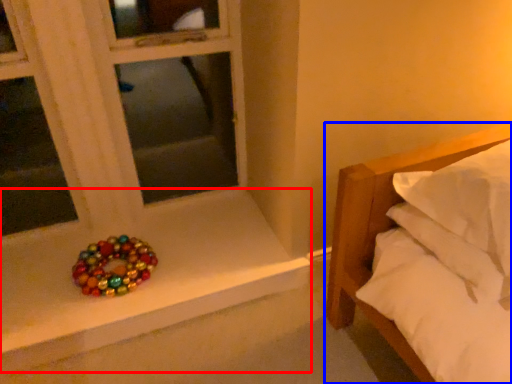
Question: Among these objects, which one is nearest to the camera, window sill (highlighted by a red box) or bed (highlighted by a blue box)?

Choices:
 (A) window sill
 (B) bed

Answer: (B)